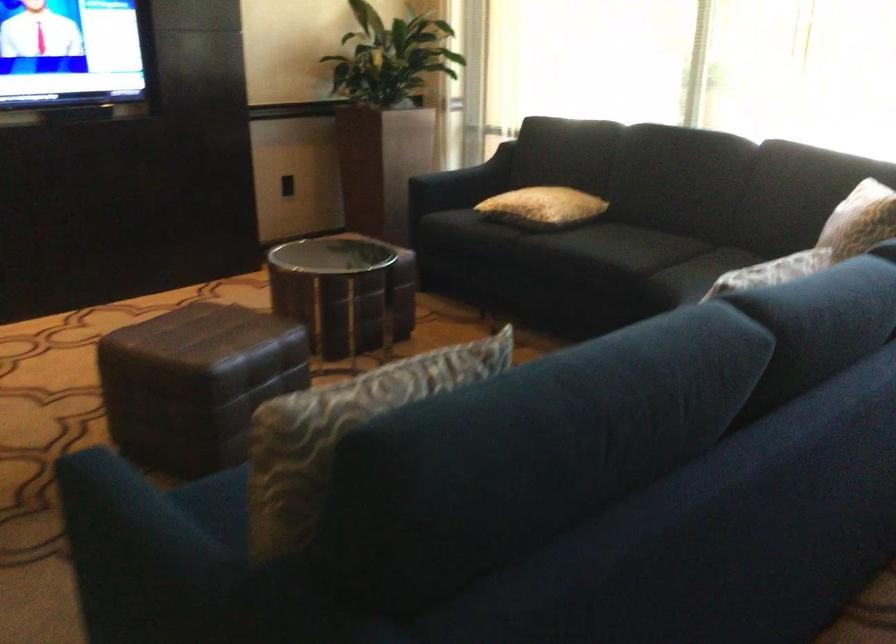
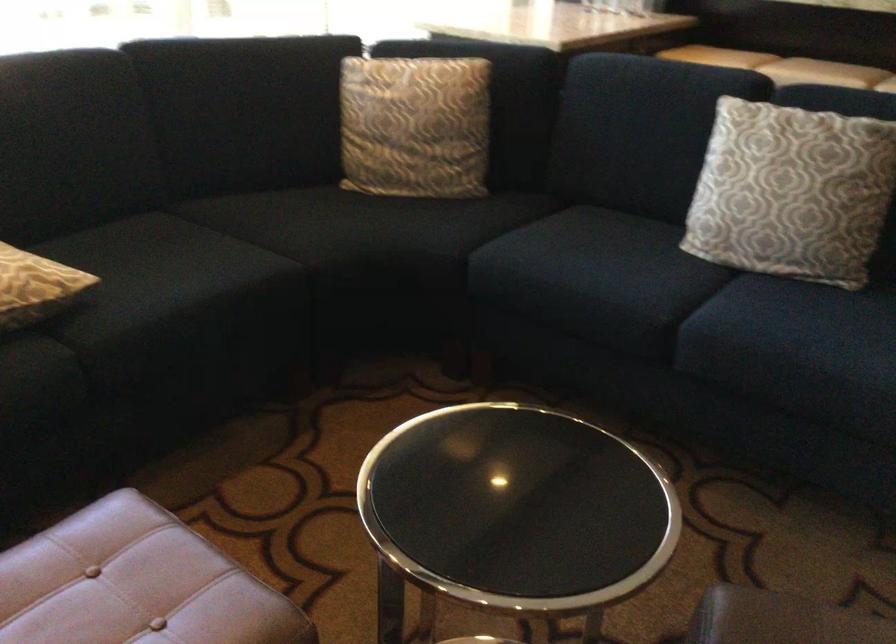
Where in the second image is the point corresponding to point (604, 241) from the first image?

(161, 270)